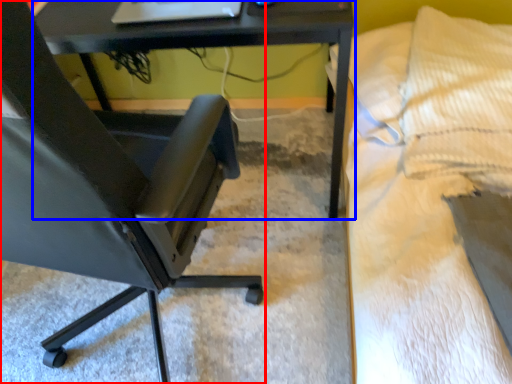
Question: Which object appears closest to the camera in this image, chair (highlighted by a red box) or table (highlighted by a blue box)?

Choices:
 (A) chair
 (B) table

Answer: (A)